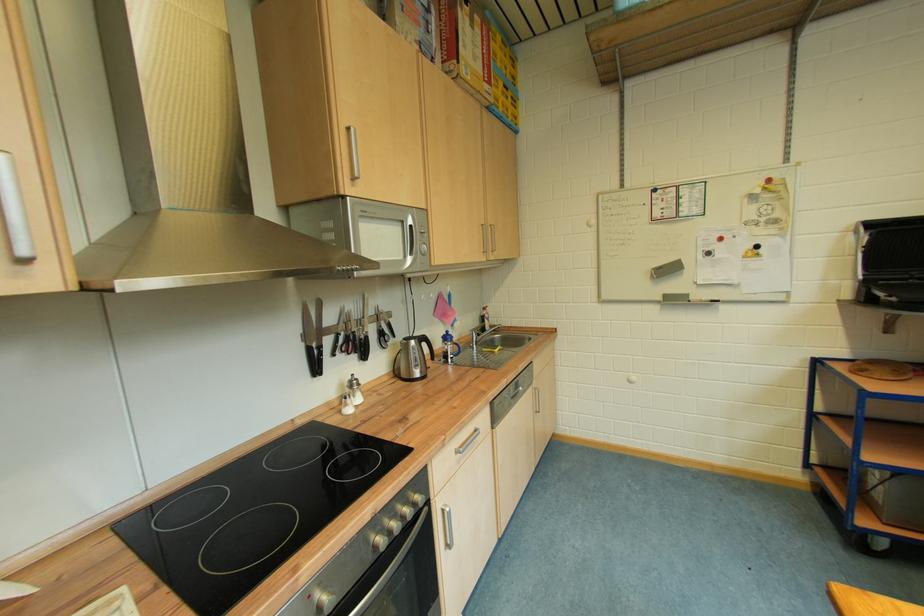
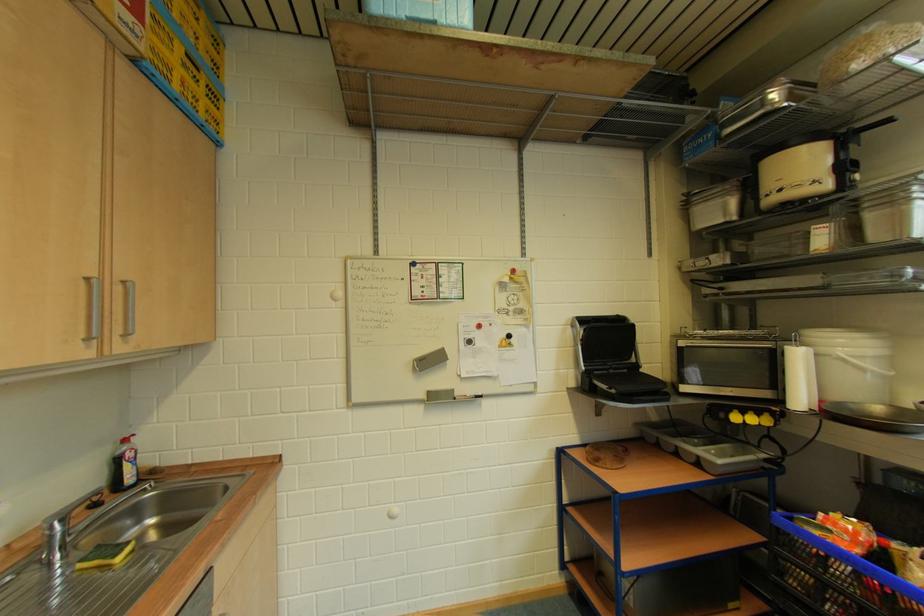
Find the pixel in the second image that matches (497,228) in the first image.

(130, 285)